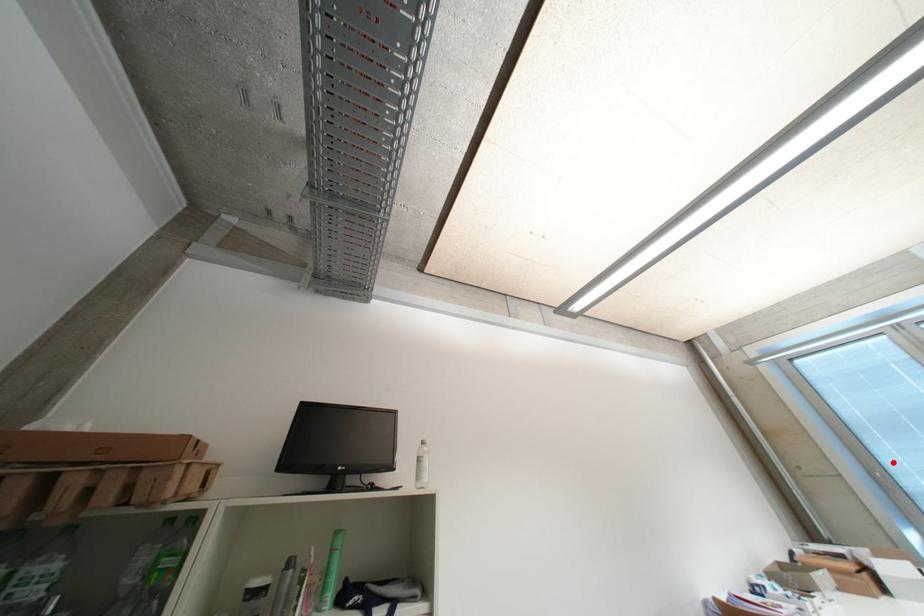
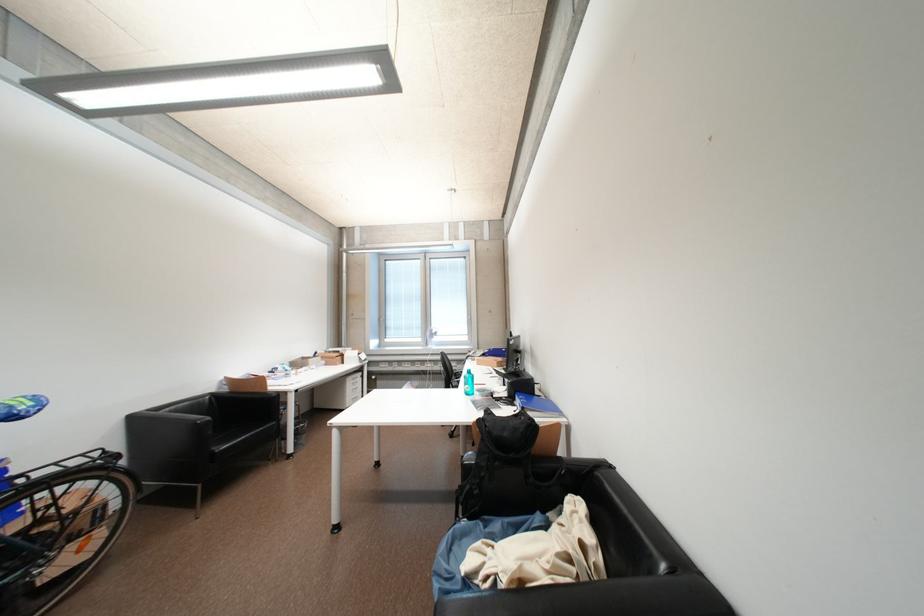
Locate, in the second image, the point that corresponds to the highlighted location in the first image.

(395, 315)